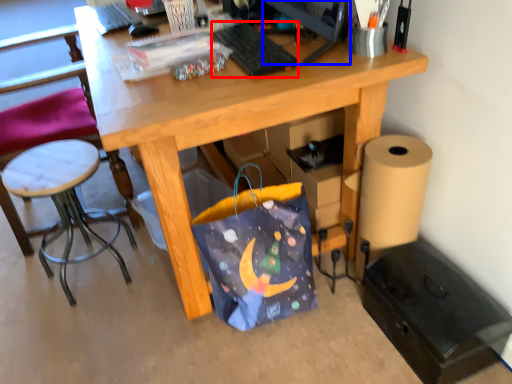
Question: Among these objects, which one is farthest to the camera, keyboard (highlighted by a red box) or computer monitor (highlighted by a blue box)?

Choices:
 (A) keyboard
 (B) computer monitor

Answer: (A)